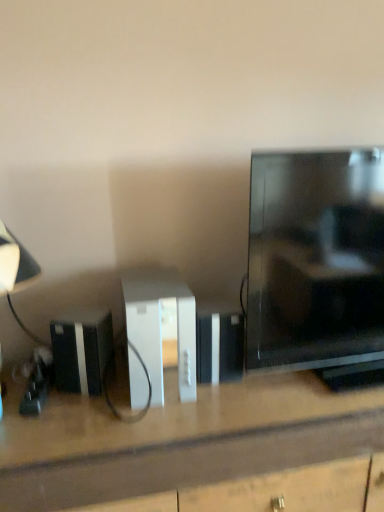
Question: In the image, is matte black lampshade at left on the left side or the right side of white matte desk at center?

Choices:
 (A) right
 (B) left

Answer: (B)

Question: Relative to white matte desk at center, is matte black lampshade at left in front or behind?

Choices:
 (A) behind
 (B) front

Answer: (A)

Question: Which is nearer to the black glossy tv at right?

Choices:
 (A) white matte desk at center
 (B) black plastic speaker at lower left
 (C) matte black lampshade at left
 (D) white plastic console at center

Answer: (A)

Question: Considering the real-world distances, which object is farthest from the white plastic console at center?

Choices:
 (A) black plastic speaker at lower left
 (B) black glossy tv at right
 (C) matte black lampshade at left
 (D) white matte desk at center

Answer: (C)